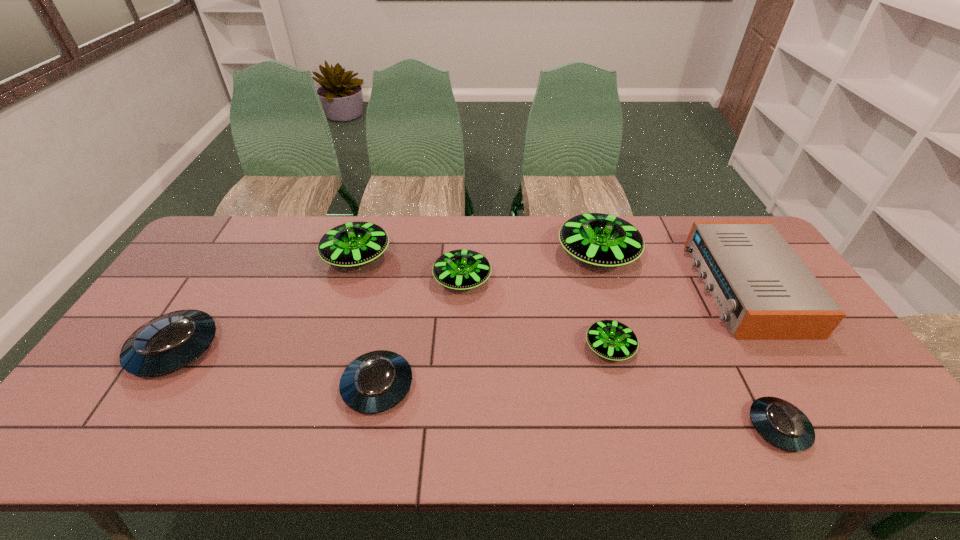
Identify the location of the second smallest gray saucer. (376, 381).

You are a GUI agent. You are given a task and a screenshot of the screen. Output one action in this format:
    pyautogui.click(x=<x>, y=<y>)
    Task: Click on the rightmost saucer
    The width and height of the screenshot is (960, 540).
    Given the screenshot: What is the action you would take?
    pyautogui.click(x=781, y=423)

This screenshot has height=540, width=960. In order to click on the smallest gray saucer in this screenshot , I will do `click(781, 423)`.

Image resolution: width=960 pixels, height=540 pixels. What are the coordinates of `free space located 0.120m on the left of the tallest saucer` in the screenshot? It's located at (521, 255).

Find the location of a particular element. This screenshot has height=540, width=960. blank space located 0.190m on the front of the second biggest green saucer is located at coordinates (335, 326).

Locate an element on the screen. vacant space situated 0.330m on the front panel of the radio receiver is located at coordinates (593, 287).

I want to click on vacant region located 0.110m on the front panel of the radio receiver, so click(x=664, y=287).

Identify the location of free space located on the front panel of the radio receiver. (661, 287).

The height and width of the screenshot is (540, 960). In order to click on vacant region located 0.100m on the back of the fourth saucer from left to right in this screenshot , I will do `click(464, 242)`.

The image size is (960, 540). Find the location of `vacant space located 0.280m on the back of the biggest gray saucer`. vacant space located 0.280m on the back of the biggest gray saucer is located at coordinates (234, 255).